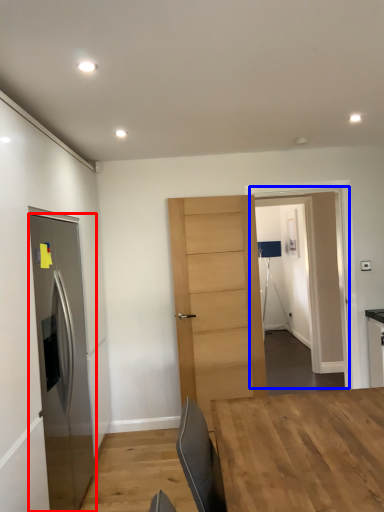
Question: Which point is closer to the camera, door (highlighted by a red box) or glass door (highlighted by a blue box)?

Choices:
 (A) door
 (B) glass door

Answer: (A)